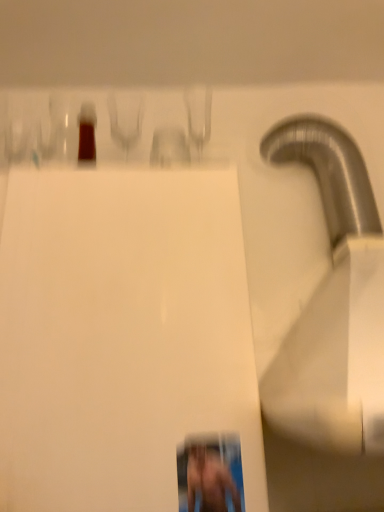
Describe the element at coordinates (121, 336) in the screenshot. I see `white glossy paper at center` at that location.

You are a GUI agent. You are given a task and a screenshot of the screen. Output one action in this format:
    pyautogui.click(x=<x>, y=<y>)
    Task: Click on the white glossy paper at center
    Image resolution: width=384 pixels, height=512 pixels.
    Given the screenshot: What is the action you would take?
    pyautogui.click(x=121, y=336)

Image resolution: width=384 pixels, height=512 pixels. Describe the element at coordinates (210, 481) in the screenshot. I see `smooth skin person at lower right` at that location.

You are a GUI agent. You are given a task and a screenshot of the screen. Output one action in this format:
    pyautogui.click(x=<x>, y=<y>)
    Task: Click on the smooth skin person at lower right
    This screenshot has width=384, height=512.
    Given the screenshot: What is the action you would take?
    pyautogui.click(x=210, y=481)

Measure the distance between point (202,457) and camera.

23.43 inches.

Find the location of a particular element. white glossy paper at center is located at coordinates (121, 336).

Which object is positioned more to the left, white glossy paper at center or smooth skin person at lower right?

Positioned to the left is white glossy paper at center.

Is white glossy paper at center positioned before smooth skin person at lower right?

Yes, white glossy paper at center is closer to the camera.

Does point (102, 266) appear closer or farther from the camera than point (212, 460)?

Point (102, 266).

From the image's perspective, which is below, white glossy paper at center or smooth skin person at lower right?

From the image's view, smooth skin person at lower right is below.

From a real-world perspective, does white glossy paper at center stand above smooth skin person at lower right?

Yes, from a real-world perspective, white glossy paper at center is on top of smooth skin person at lower right.

In the scene shown: Which of these two, white glossy paper at center or smooth skin person at lower right, is wider?

Wider between the two is white glossy paper at center.

Does white glossy paper at center have a greater height compared to smooth skin person at lower right?

Yes, white glossy paper at center is taller than smooth skin person at lower right.

Which of these two, white glossy paper at center or smooth skin person at lower right, is bigger?

white glossy paper at center.

Is white glossy paper at center spatially inside smooth skin person at lower right, or outside of it?

white glossy paper at center is located beyond the bounds of smooth skin person at lower right.

Are white glossy paper at center and smooth skin person at lower right far apart?

white glossy paper at center is near smooth skin person at lower right, not far away.

Is white glossy paper at center oriented towards smooth skin person at lower right?

Yes, white glossy paper at center is aimed at smooth skin person at lower right.

You are a GUI agent. You are given a task and a screenshot of the screen. Output one action in this format:
    pyautogui.click(x=<x>, y=<y>)
    Task: Click on the person that is behind the white glossy paper at center
    The width and height of the screenshot is (384, 512).
    Given the screenshot: What is the action you would take?
    pyautogui.click(x=210, y=481)

Can you confirm if smooth skin person at lower right is positioned to the right of white glossy paper at center?

Yes.

Is the depth of smooth skin person at lower right less than that of white glossy paper at center?

No, smooth skin person at lower right is further to the viewer.

Does point (208, 449) lie in front of point (96, 262)?

Yes, it is.

From the image's perspective, which is above, smooth skin person at lower right or white glossy paper at center?

white glossy paper at center, from the image's perspective.

From a real-world perspective, is smooth skin person at lower right positioned above or below white glossy paper at center?

In terms of real-world spatial position, smooth skin person at lower right is below white glossy paper at center.

Which of these two, smooth skin person at lower right or white glossy paper at center, is thinner?

smooth skin person at lower right.

Between smooth skin person at lower right and white glossy paper at center, which one has more height?

white glossy paper at center is taller.

Who is bigger, smooth skin person at lower right or white glossy paper at center?

white glossy paper at center.

Is smooth skin person at lower right completely or partially outside of white glossy paper at center?

No, smooth skin person at lower right is inside or overlapping with white glossy paper at center.

Is smooth skin person at lower right next to white glossy paper at center?

No, smooth skin person at lower right is not next to white glossy paper at center.

Is smooth skin person at lower right positioned with its back to white glossy paper at center?

Correct, smooth skin person at lower right is looking away from white glossy paper at center.

This screenshot has height=512, width=384. What are the coordinates of `person below the white glossy paper at center (from the image's perspective)` in the screenshot? It's located at (210, 481).

Where is `person below the white glossy paper at center (from a real-world perspective)`? The height and width of the screenshot is (512, 384). person below the white glossy paper at center (from a real-world perspective) is located at coordinates (210, 481).

Locate an element on the screen. This screenshot has width=384, height=512. person below the white glossy paper at center (from the image's perspective) is located at coordinates click(x=210, y=481).